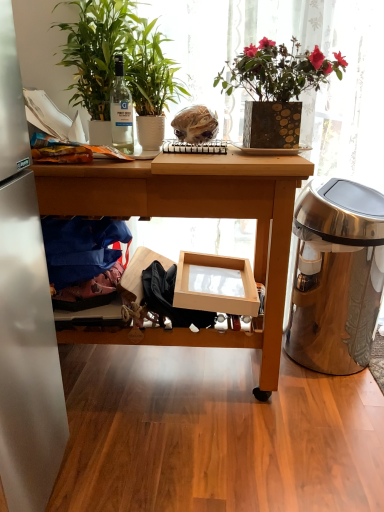
Locate an element on the screen. Image resolution: width=384 pixels, height=512 pixels. vacant area that is in front of stainless steel trash can at right is located at coordinates (332, 413).